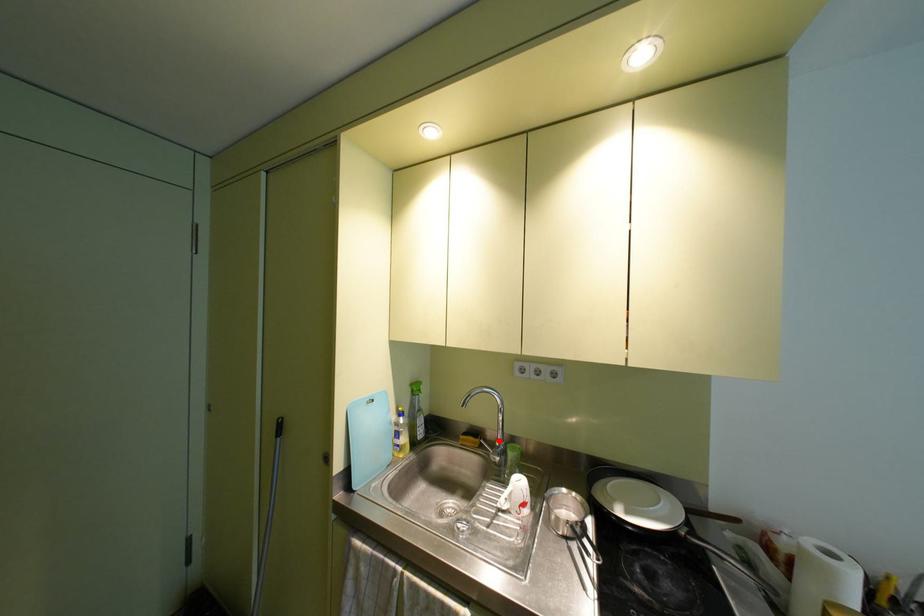
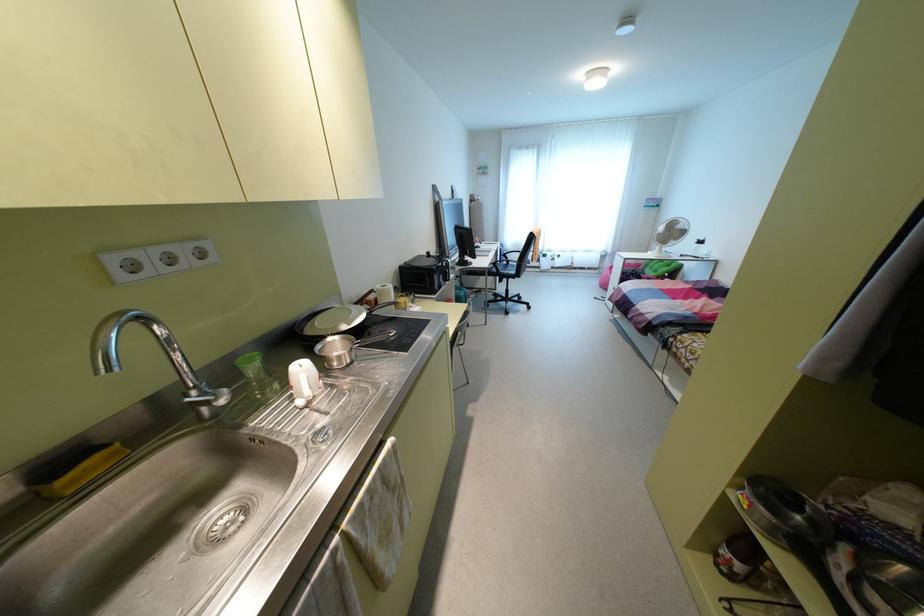
Question: I am providing you with two images of the same scene from different viewpoints. Given a red point in image1, look at the same physical point in image2. Is it:

Choices:
 (A) Closer to the viewpoint
 (B) Farther from the viewpoint

Answer: (A)